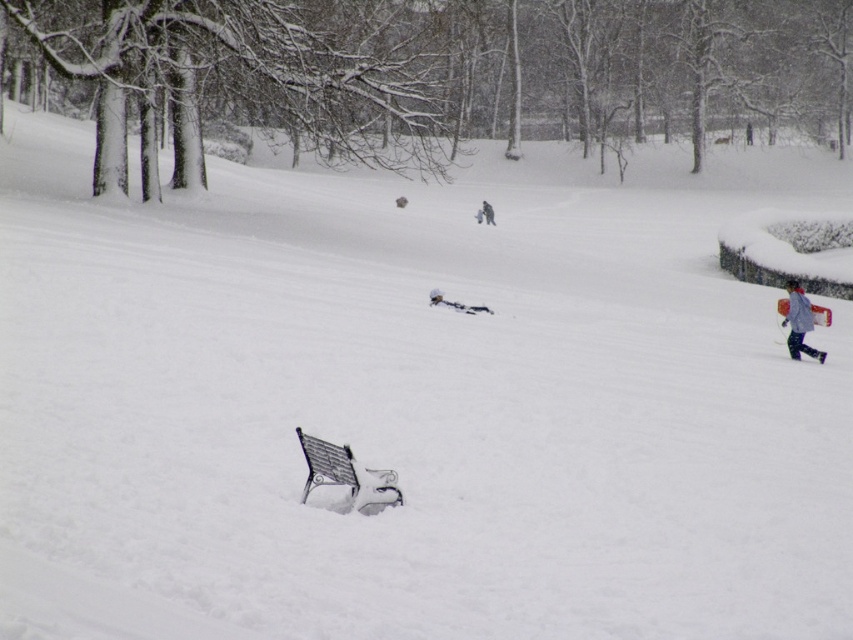
You are standing at the center of the snowy area and see the light blue fabric jacket at right. Based on its position, can you estimate whether the jacket is closer to the left or right edge of the scene?

The light blue fabric jacket at right is located at point 0.505 on the x and y axis, so it is closer to the right edge of the scene.

You are an observer in the winter scene. You notice two items of clothing, the light blue fabric jacket at right and the light blue fabric snowsuit at center. Which one appears larger in size?

The light blue fabric jacket at right is bigger than the light blue fabric snowsuit at center.

You are a photographer trying to capture both the light blue fabric jacket at right and the light blue fabric snowsuit at center in a single frame. Since the camera has a limited field of view, you need to know which one is narrower to position them properly. Which object is narrower?

The light blue fabric jacket at right is narrower than the light blue fabric snowsuit at center because its width is less than the snowsuit.